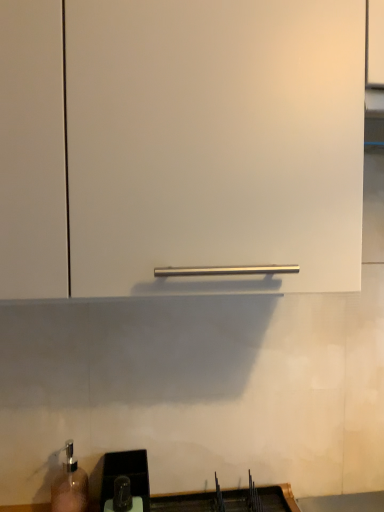
Question: Is white matte cabinet handle at center in front of or behind black plastic sink at lower center in the image?

Choices:
 (A) front
 (B) behind

Answer: (A)

Question: Considering the positions of point (190, 74) and point (249, 497), is point (190, 74) closer or farther from the camera than point (249, 497)?

Choices:
 (A) closer
 (B) farther

Answer: (A)

Question: Considering the positions of white matte cabinet handle at center and black plastic sink at lower center in the image, is white matte cabinet handle at center wider or thinner than black plastic sink at lower center?

Choices:
 (A) wide
 (B) thin

Answer: (A)

Question: Is point (127, 465) closer or farther from the camera than point (321, 151)?

Choices:
 (A) farther
 (B) closer

Answer: (A)

Question: Considering their positions, is black plastic sink at lower center located in front of or behind white matte cabinet handle at center?

Choices:
 (A) behind
 (B) front

Answer: (A)

Question: In the image, is black plastic sink at lower center on the left side or the right side of white matte cabinet handle at center?

Choices:
 (A) right
 (B) left

Answer: (B)

Question: Considering the positions of black plastic sink at lower center and white matte cabinet handle at center in the image, is black plastic sink at lower center taller or shorter than white matte cabinet handle at center?

Choices:
 (A) short
 (B) tall

Answer: (A)